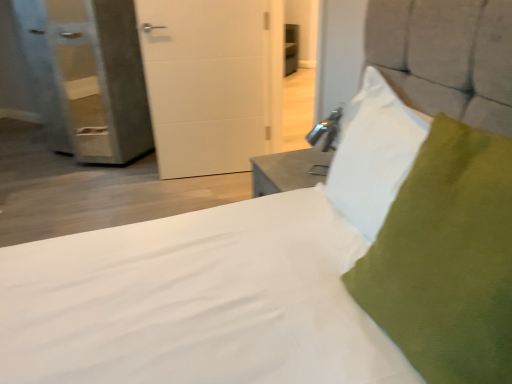
Question: Considering the positions of textured gray pillow at upper right, the 2th pillow when ordered from front to back, and green fabric pillow at upper right, placed as the second pillow when sorted from back to front, in the image, is textured gray pillow at upper right, the 2th pillow when ordered from front to back, taller or shorter than green fabric pillow at upper right, placed as the second pillow when sorted from back to front,?

Choices:
 (A) tall
 (B) short

Answer: (B)

Question: Based on their sizes in the image, would you say textured gray pillow at upper right, which ranks as the 1th pillow in back-to-front order, is bigger or smaller than green fabric pillow at upper right, acting as the first pillow starting from the front?

Choices:
 (A) big
 (B) small

Answer: (B)

Question: Based on their relative distances, which object is farther from the textured gray pillow at upper right, the 2th pillow when ordered from front to back?

Choices:
 (A) green fabric pillow at upper right, placed as the second pillow when sorted from back to front
 (B) white matte door at center

Answer: (B)

Question: Which of these objects is positioned farthest from the green fabric pillow at upper right, acting as the first pillow starting from the front?

Choices:
 (A) textured gray pillow at upper right, which ranks as the 1th pillow in back-to-front order
 (B) white matte door at center

Answer: (B)